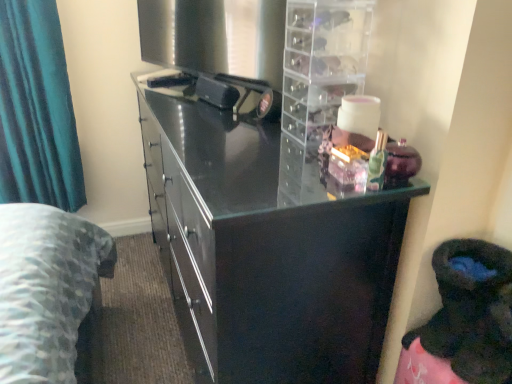
Question: Is glossy black cupboard at center further to camera compared to clear plastic drawer unit at upper right?

Choices:
 (A) yes
 (B) no

Answer: (B)

Question: Is glossy black cupboard at center to the right of clear plastic drawer unit at upper right from the viewer's perspective?

Choices:
 (A) yes
 (B) no

Answer: (B)

Question: Is clear plastic drawer unit at upper right completely or partially inside glossy black cupboard at center?

Choices:
 (A) no
 (B) yes

Answer: (A)

Question: From the image's perspective, does glossy black cupboard at center appear lower than clear plastic drawer unit at upper right?

Choices:
 (A) yes
 (B) no

Answer: (A)

Question: From the image's perspective, is glossy black cupboard at center over clear plastic drawer unit at upper right?

Choices:
 (A) no
 (B) yes

Answer: (A)

Question: Would you say glossy black cupboard at center is to the left or to the right of clear plastic drawer unit at upper right in the picture?

Choices:
 (A) left
 (B) right

Answer: (A)

Question: From the image's perspective, is glossy black cupboard at center located above or below clear plastic drawer unit at upper right?

Choices:
 (A) below
 (B) above

Answer: (A)

Question: From their relative heights in the image, would you say glossy black cupboard at center is taller or shorter than clear plastic drawer unit at upper right?

Choices:
 (A) tall
 (B) short

Answer: (A)

Question: Considering the positions of glossy black cupboard at center and clear plastic drawer unit at upper right in the image, is glossy black cupboard at center wider or thinner than clear plastic drawer unit at upper right?

Choices:
 (A) wide
 (B) thin

Answer: (A)

Question: Considering the positions of point (200, 297) and point (33, 74), is point (200, 297) closer or farther from the camera than point (33, 74)?

Choices:
 (A) closer
 (B) farther

Answer: (A)

Question: From the image's perspective, relative to teal fabric curtain at left, is glossy black cupboard at center above or below?

Choices:
 (A) below
 (B) above

Answer: (A)

Question: Is glossy black cupboard at center inside the boundaries of teal fabric curtain at left, or outside?

Choices:
 (A) outside
 (B) inside

Answer: (A)

Question: Relative to teal fabric curtain at left, is glossy black cupboard at center in front or behind?

Choices:
 (A) behind
 (B) front

Answer: (B)

Question: Is teal fabric curtain at left inside or outside of clear plastic drawer unit at upper right?

Choices:
 (A) outside
 (B) inside

Answer: (A)

Question: Considering the positions of teal fabric curtain at left and clear plastic drawer unit at upper right in the image, is teal fabric curtain at left wider or thinner than clear plastic drawer unit at upper right?

Choices:
 (A) thin
 (B) wide

Answer: (A)